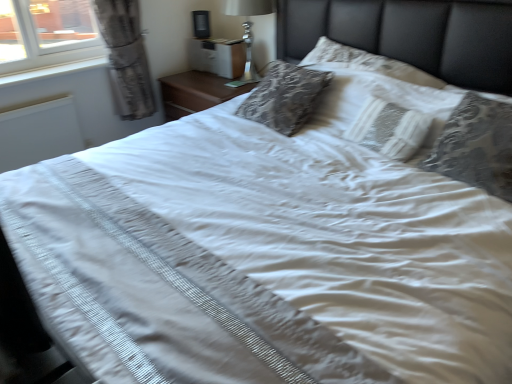
Where is `vacant region above white plastic window sill at left (from a real-world perspective)`? The height and width of the screenshot is (384, 512). vacant region above white plastic window sill at left (from a real-world perspective) is located at coordinates (58, 71).